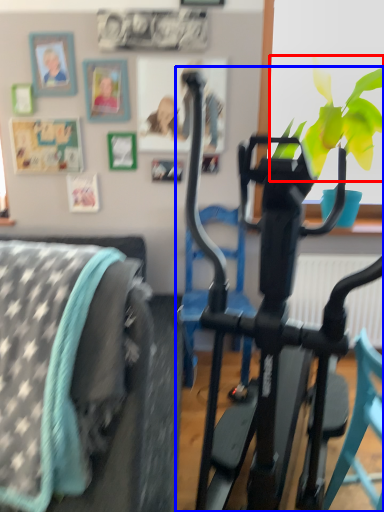
Question: Which of the following is the closest to the observer, flower (highlighted by a red box) or stationary bicycle (highlighted by a blue box)?

Choices:
 (A) flower
 (B) stationary bicycle

Answer: (B)